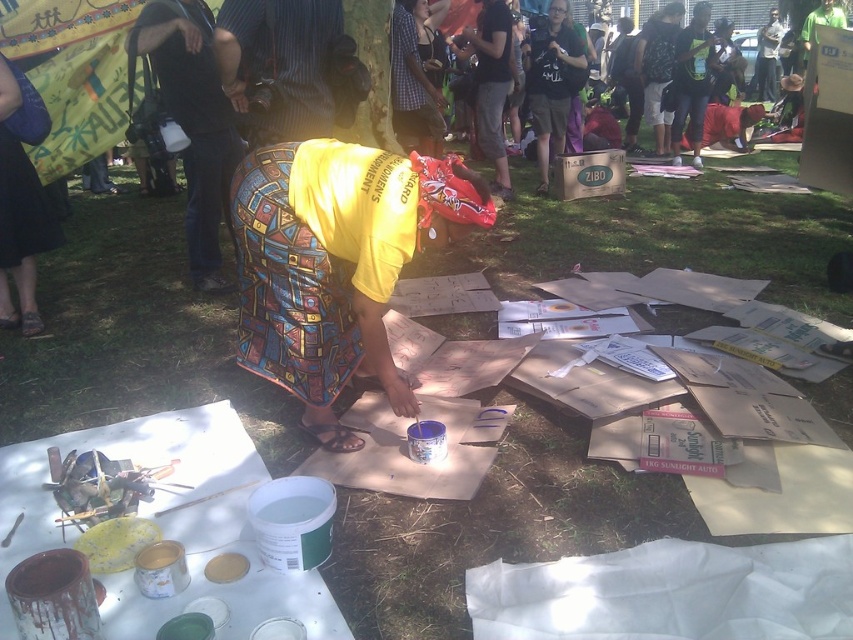
You are a photographer standing at the edge of the scene. You want to capture a photo where both the yellow printed fabric at center and the blue fabric skirt at lower left are visible in the frame. Given the distance between them, is it feasible to include both in a single shot without moving your position?

The distance between the yellow printed fabric at center and the blue fabric skirt at lower left is 6.15 feet. Since you are positioned at the edge, it should be possible to frame the shot to include both objects as they are within a reasonable distance apart.

You are an observer standing in front of the person creating art. You notice the yellow printed fabric at center and the blue fabric skirt at lower left. Which fabric is located closer to the ground?

The blue fabric skirt at lower left is closer to the ground because the yellow printed fabric at center is positioned under it.

You are an observer looking at the artist working. Which object is positioned to the left of the other between the blue fabric skirt at lower left and the black cotton shirt at upper center?

The blue fabric skirt at lower left is positioned to the left of the black cotton shirt at upper center.